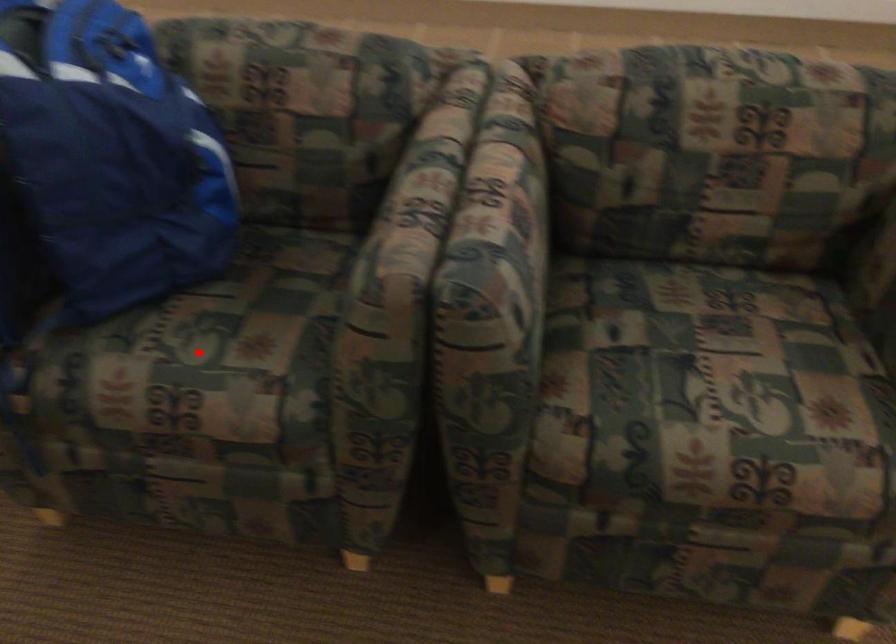
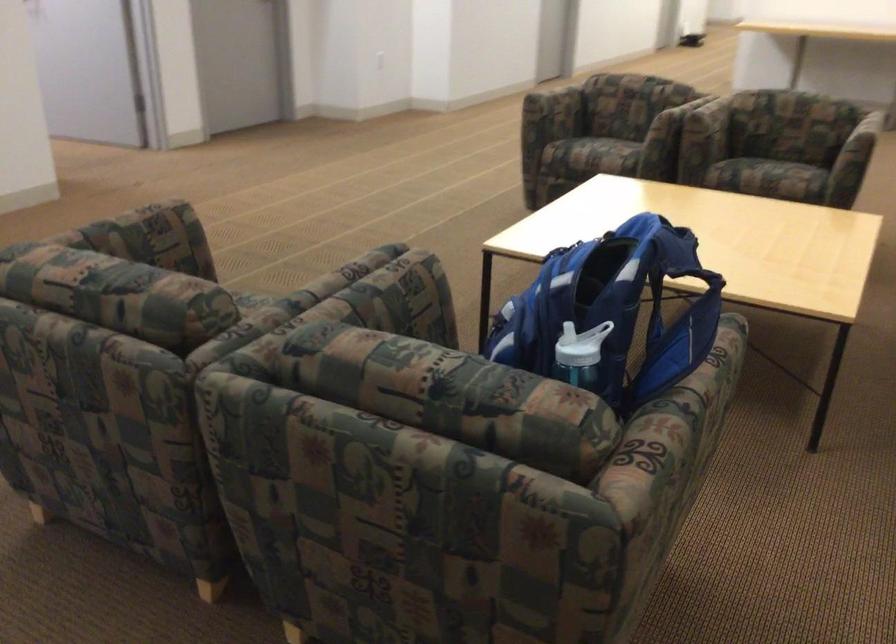
Question: I am providing you with two images of the same scene from different viewpoints. A red point is marked on the first image. Can you still see the location of the red point in image 2?

Choices:
 (A) Yes
 (B) No

Answer: (B)